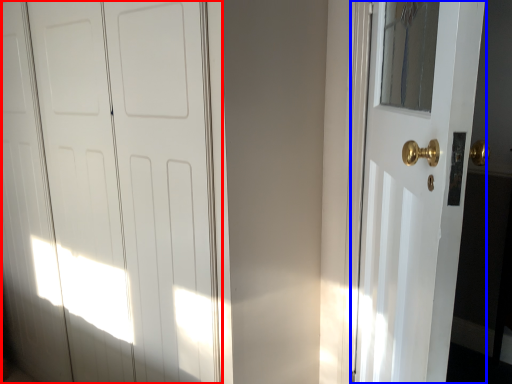
Question: Among these objects, which one is nearest to the camera, door (highlighted by a red box) or door (highlighted by a blue box)?

Choices:
 (A) door
 (B) door

Answer: (B)